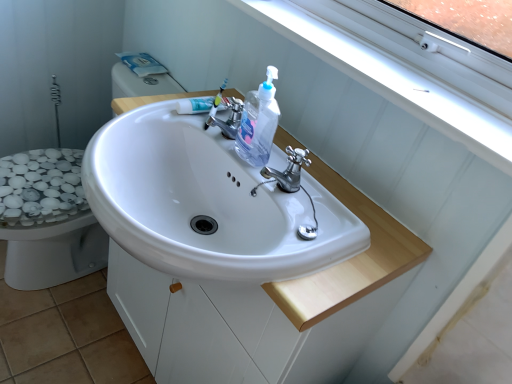
You are a GUI agent. You are given a task and a screenshot of the screen. Output one action in this format:
    pyautogui.click(x=<x>, y=<y>)
    Task: Click on the vacant area that lies to the right of clear plastic bottle at center
    Image resolution: width=512 pixels, height=384 pixels.
    Given the screenshot: What is the action you would take?
    pyautogui.click(x=336, y=185)